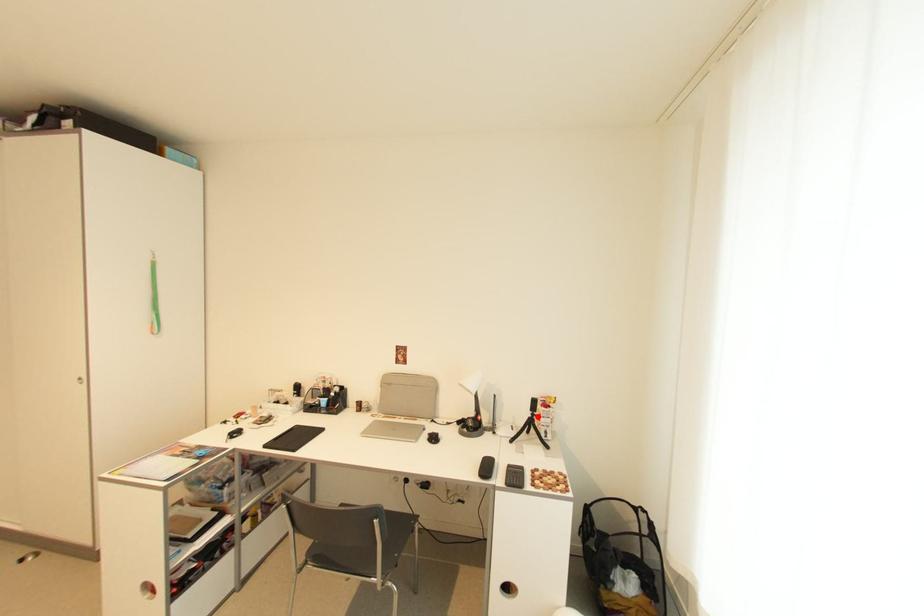
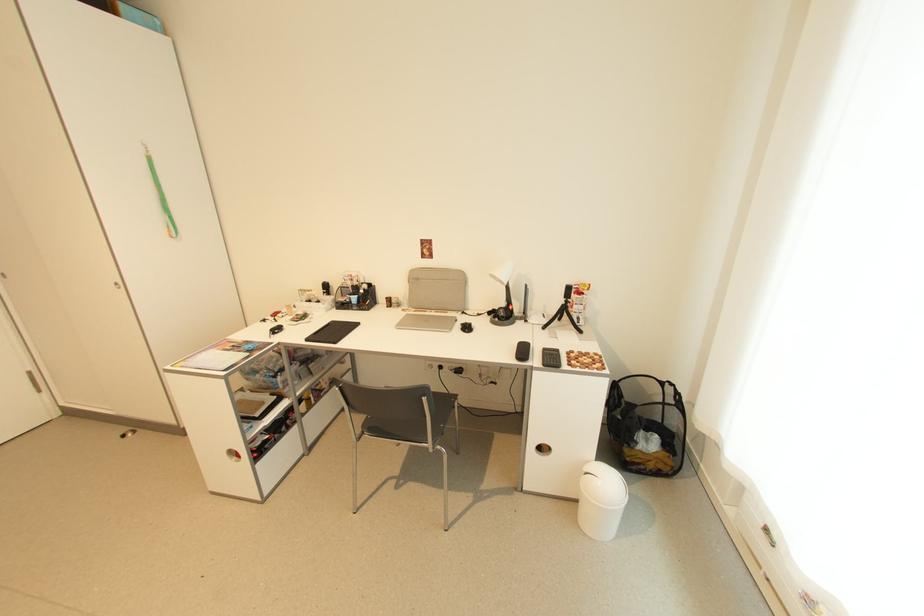
Question: I am providing you with two images of the same scene from different viewpoints. Given a red point in image1, look at the same physical point in image2. Is it:

Choices:
 (A) Closer to the viewpoint
 (B) Farther from the viewpoint

Answer: (A)